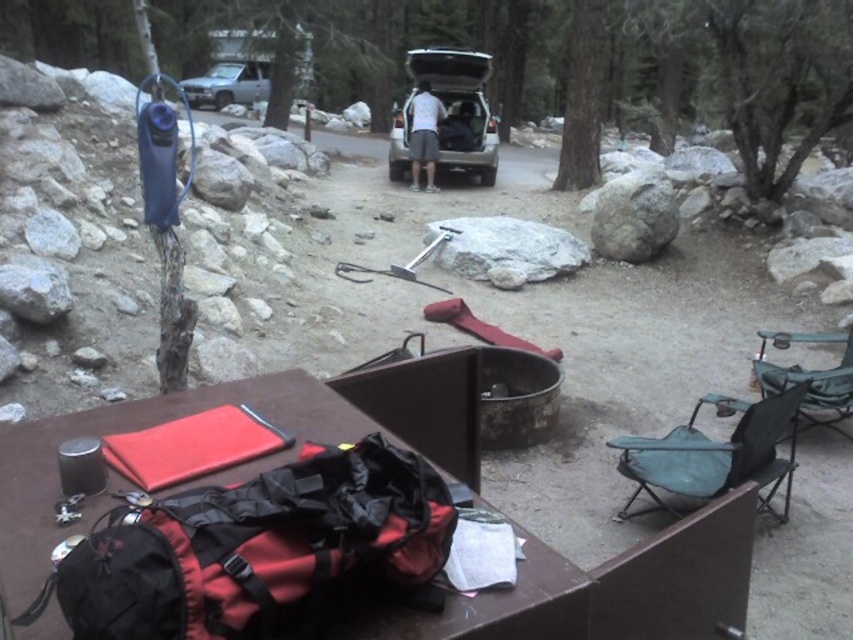
You are a hiker who needs to reach the rubberized red duffel bag at center. Can you estimate if you can comfortably reach it without moving your position, considering your arm length is 75 centimeters?

The rubberized red duffel bag at center is 85.25 centimeters away from the camera. Since your arm length is 75 centimeters, you cannot comfortably reach it without moving your position.

You are a hiker trying to navigate between two points in the forest. You see a point at coordinate (834, 387) and another at (213, 92). Which point is closer to you if you are standing at the picnic table?

Point (834, 387) is in front of point (213, 92), so it is closer to you at the picnic table.

You are setting up a campsite and need to know the relative positions of the green fabric folding chair at right and the brushed metal truck at upper left. Which object is located on the right side from your perspective?

The green fabric folding chair at right is located to the right of the brushed metal truck at upper left, so from your perspective, the green fabric folding chair at right is on the right side.